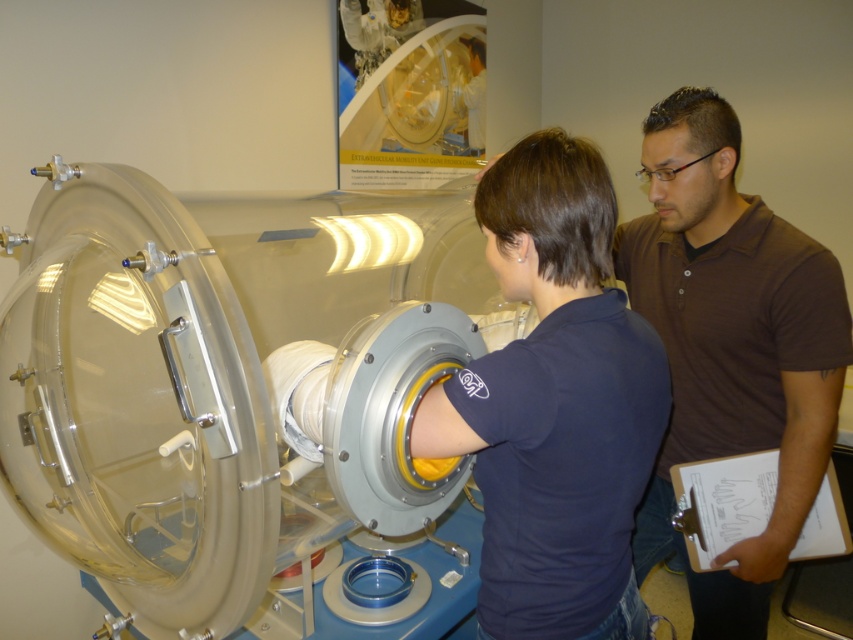
Question: Which point appears closest to the camera in this image?

Choices:
 (A) (167, 474)
 (B) (828, 372)

Answer: (B)

Question: Which of the following is the farthest from the observer?

Choices:
 (A) (677, 173)
 (B) (474, 580)

Answer: (B)

Question: Is transparent plastic cylinder at center thinner than brown smooth shirt at center?

Choices:
 (A) no
 (B) yes

Answer: (A)

Question: Is transparent plastic cylinder at center thinner than brown smooth shirt at center?

Choices:
 (A) yes
 (B) no

Answer: (B)

Question: Does transparent plastic cylinder at center have a smaller size compared to brown smooth shirt at center?

Choices:
 (A) no
 (B) yes

Answer: (A)